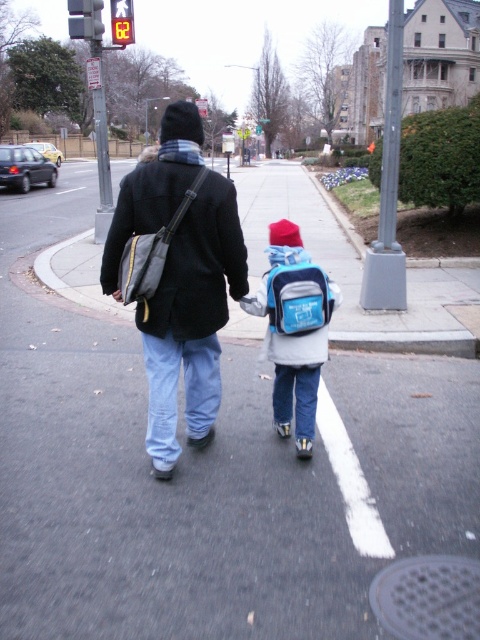
Which is behind, point (169, 266) or point (282, 340)?

Positioned behind is point (282, 340).

The image size is (480, 640). What do you see at coordinates (200, 268) in the screenshot?
I see `dark matte jacket at upper left` at bounding box center [200, 268].

Where is `dark matte jacket at upper left`? Image resolution: width=480 pixels, height=640 pixels. dark matte jacket at upper left is located at coordinates (200, 268).

You are a GUI agent. You are given a task and a screenshot of the screen. Output one action in this format:
    pyautogui.click(x=<x>, y=<y>)
    Task: Click on the dark matte jacket at upper left
    The height and width of the screenshot is (640, 480).
    Given the screenshot: What is the action you would take?
    pyautogui.click(x=200, y=268)

Is the position of dark matte jacket at upper left less distant than that of red plastic traffic light at upper left?

Yes, dark matte jacket at upper left is closer to the viewer.

Which is in front, point (172, 176) or point (117, 38)?

Point (172, 176) is more forward.

The height and width of the screenshot is (640, 480). What are the coordinates of `dark matte jacket at upper left` in the screenshot? It's located at (200, 268).

How much distance is there between blue fabric backpack at center and red plastic traffic light at upper left?

10.59 meters

Does blue fabric backpack at center have a greater width compared to red plastic traffic light at upper left?

Indeed, blue fabric backpack at center has a greater width compared to red plastic traffic light at upper left.

What do you see at coordinates (295, 328) in the screenshot?
I see `blue fabric backpack at center` at bounding box center [295, 328].

I want to click on blue fabric backpack at center, so click(295, 328).